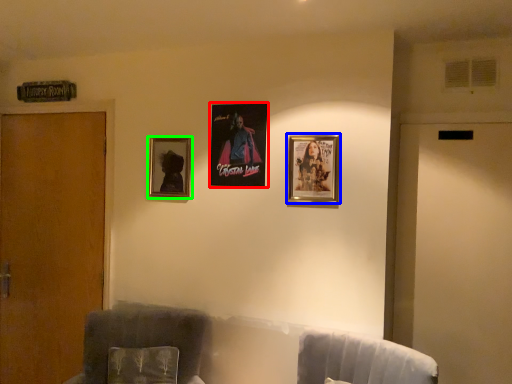
Question: Which object is the closest to the picture frame (highlighted by a red box)? Choose among these: picture frame (highlighted by a blue box) or picture frame (highlighted by a green box).

Choices:
 (A) picture frame
 (B) picture frame

Answer: (B)